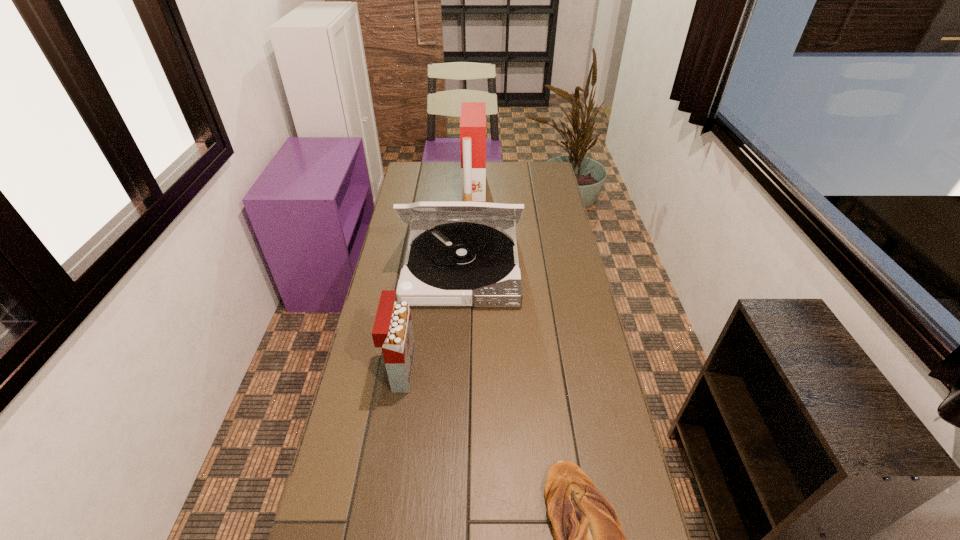
This screenshot has width=960, height=540. Identify the location of the taller cigarette case. (473, 114).

Where is `the farthest object`? This screenshot has width=960, height=540. the farthest object is located at coordinates (473, 114).

The height and width of the screenshot is (540, 960). Find the location of `the second farthest object`. the second farthest object is located at coordinates pyautogui.click(x=465, y=260).

At what (x,y) coordinates should I click in order to perform the action: click on the third tallest object. Please return your answer as a coordinate pair (x, y). The height and width of the screenshot is (540, 960). Looking at the image, I should click on (392, 331).

Locate an element on the screen. The image size is (960, 540). the nearer cigarette case is located at coordinates (392, 331).

This screenshot has width=960, height=540. I want to click on vacant space located 0.160m on the front-facing side of the farthest object, so click(519, 190).

Identify the location of free space located on the control panel of the third nearest object. (456, 383).

I want to click on vacant position located 0.280m with the lid open on the shorter cigarette case, so click(507, 370).

Where is `object situated at the far edge`? Image resolution: width=960 pixels, height=540 pixels. object situated at the far edge is located at coordinates (473, 114).

Find the location of a particular element. CD player at the left edge is located at coordinates (465, 260).